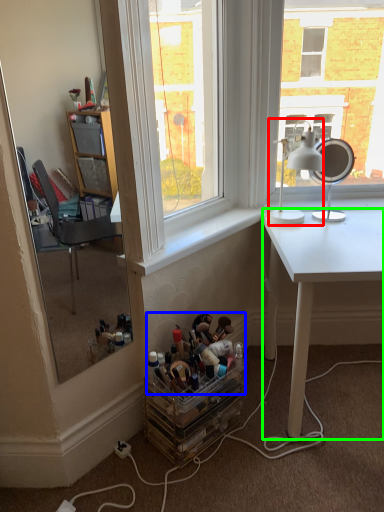
Question: Which is farther away from table lamp (highlighted by a red box)? toy (highlighted by a blue box) or desk (highlighted by a green box)?

Choices:
 (A) toy
 (B) desk

Answer: (A)